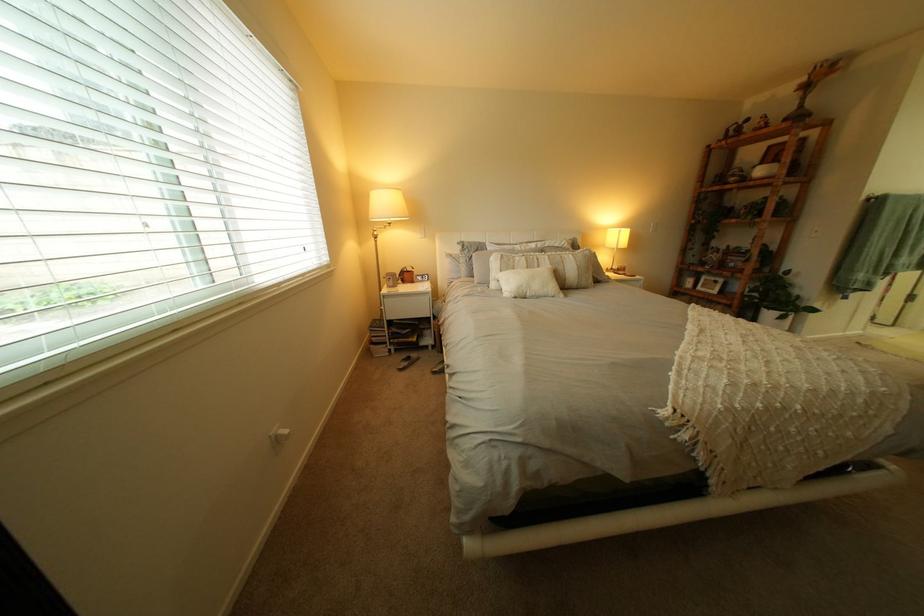
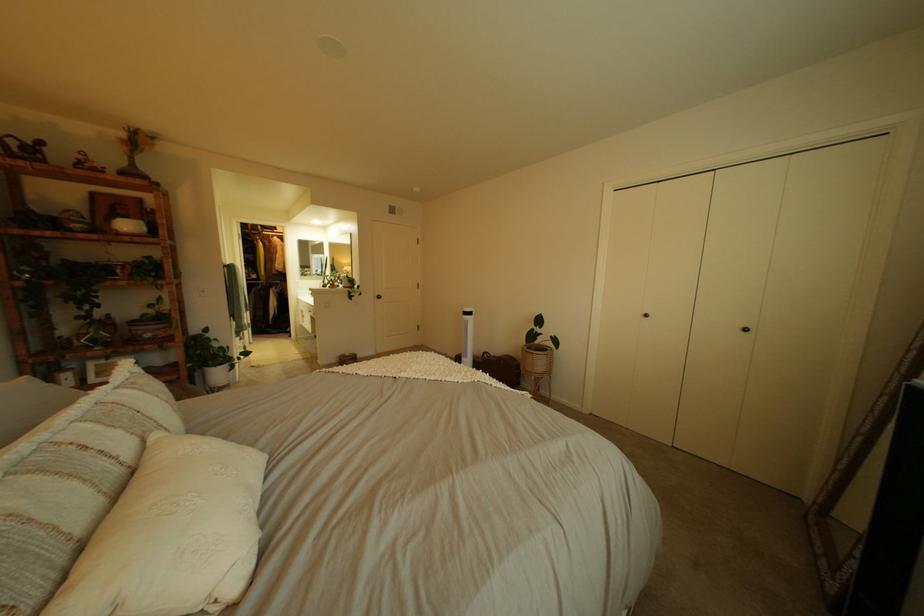
In the second image, find the point that corresponds to point 564,264 in the first image.

(134, 434)